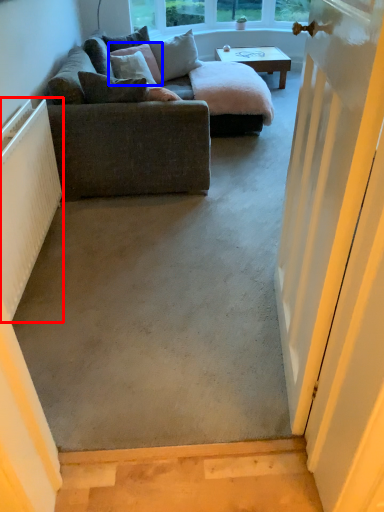
Question: Which object is closer to the camera taking this photo, radiator (highlighted by a red box) or pillow (highlighted by a blue box)?

Choices:
 (A) radiator
 (B) pillow

Answer: (A)